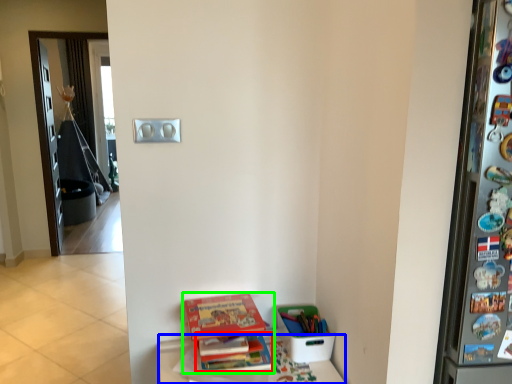
Question: Which object is positioned farthest from book (highlighted by a red box)? Select from furniture (highlighted by a blue box) and book (highlighted by a green box).

Choices:
 (A) furniture
 (B) book

Answer: (A)